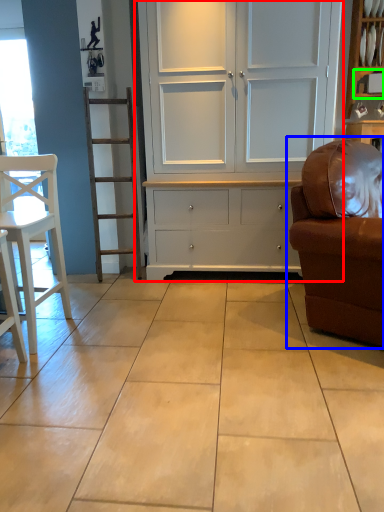
Question: Which is nearer to the cupboard (highlighted by a red box)? studio couch (highlighted by a blue box) or shelf (highlighted by a green box).

Choices:
 (A) studio couch
 (B) shelf

Answer: (A)